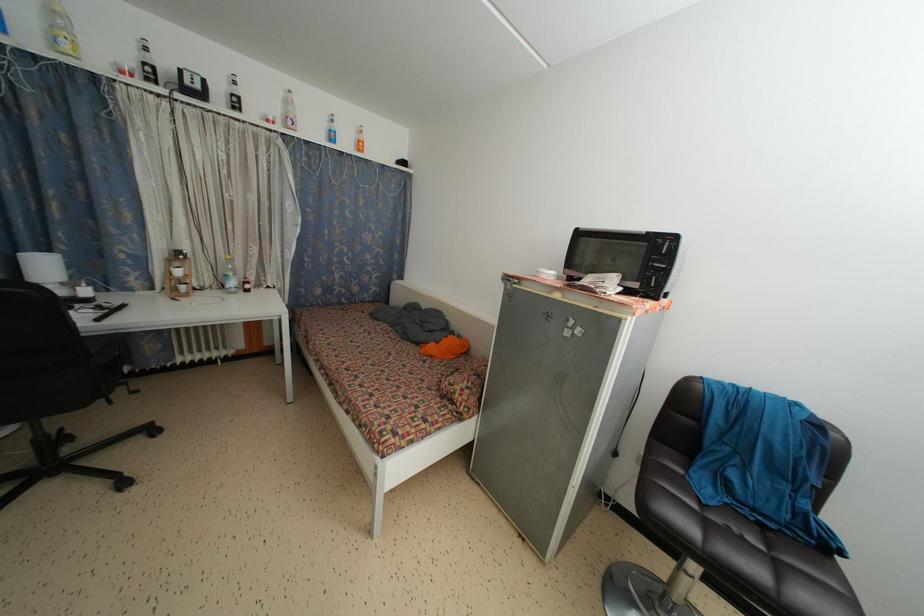
The image size is (924, 616). I want to click on bed sitting surface, so click(381, 376).